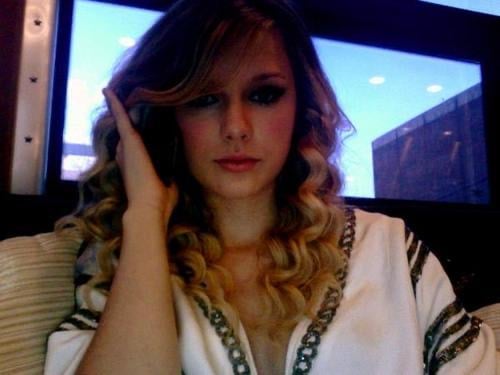
Identify the location of pillow. (36, 284).